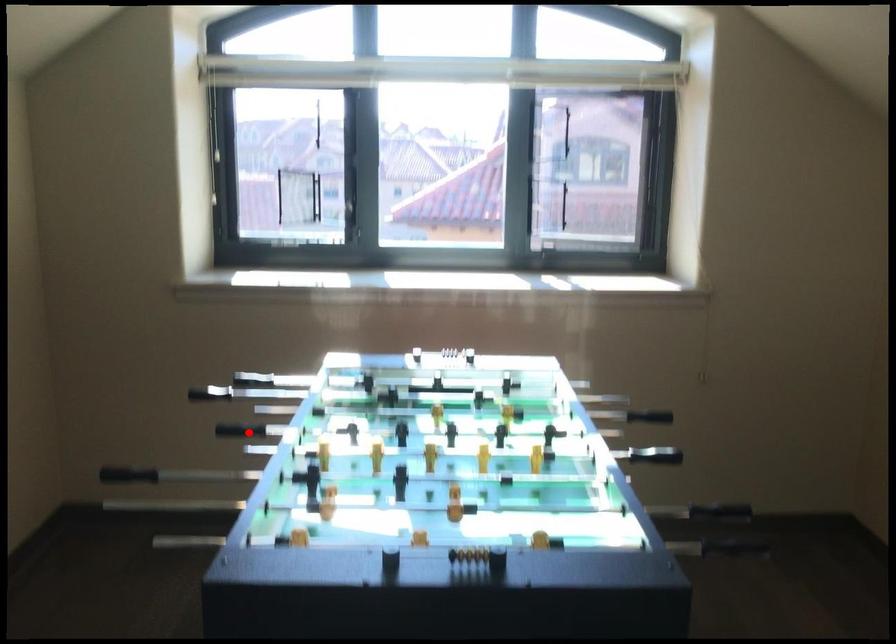
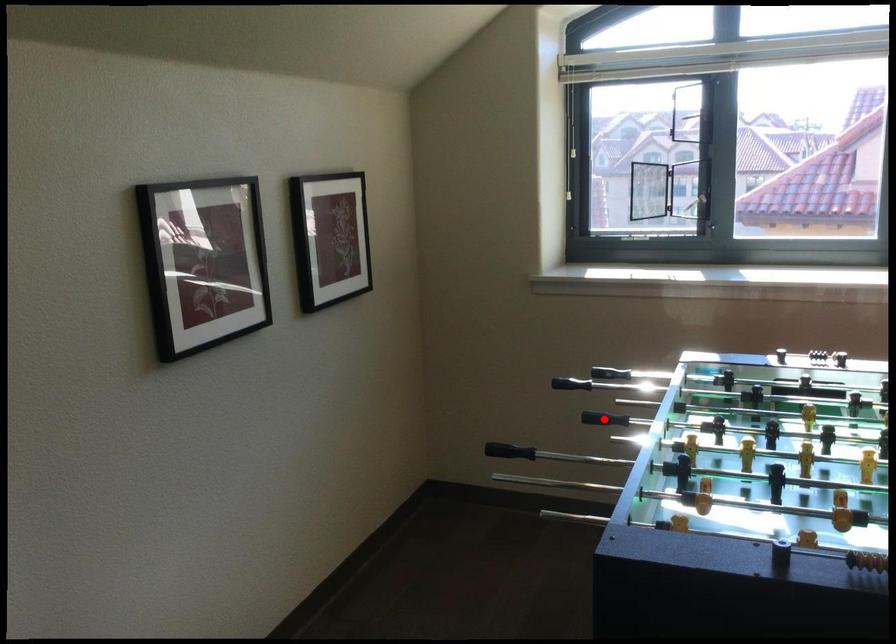
I am providing you with two images of the same scene from different viewpoints. A red point is marked on the first image and another point is marked on the second image. Is the red point in image1 aligned with the point shown in image2?

Yes